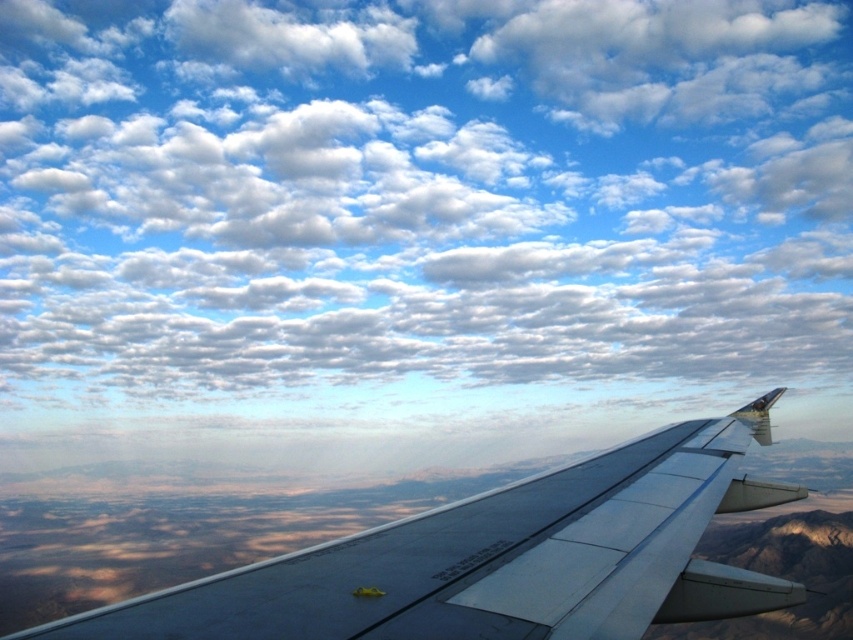
Does white fluffy cloud at upper center appear under metallic gray wing at center?

Actually, white fluffy cloud at upper center is above metallic gray wing at center.

Which is more to the left, white fluffy cloud at upper center or metallic gray wing at center?

From the viewer's perspective, white fluffy cloud at upper center appears more on the left side.

Is point (801, 212) in front of point (486, 608)?

No, it is not.

This screenshot has height=640, width=853. What are the coordinates of `white fluffy cloud at upper center` in the screenshot? It's located at (422, 192).